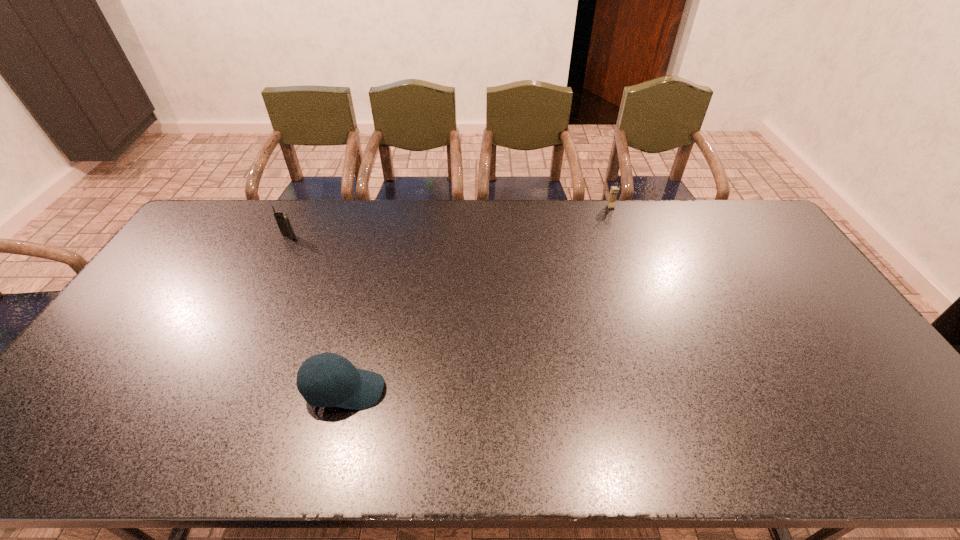
The height and width of the screenshot is (540, 960). In order to click on the right cellular telephone in this screenshot , I will do `click(614, 190)`.

Locate an element on the screen. The width and height of the screenshot is (960, 540). the farther cellular telephone is located at coordinates (614, 190).

Locate an element on the screen. This screenshot has height=540, width=960. the nearer cellular telephone is located at coordinates (282, 219).

Find the location of a particular element. Image resolution: width=960 pixels, height=540 pixels. the leftmost object is located at coordinates (282, 219).

This screenshot has width=960, height=540. Identify the location of the second object from left to right. (357, 389).

Where is `the nearest object`? the nearest object is located at coordinates (357, 389).

You are a GUI agent. You are given a task and a screenshot of the screen. Output one action in this format:
    pyautogui.click(x=<x>, y=<y>)
    Task: Click on the blank space located 0.270m on the front of the rightmost object, where the keypad is located
    Image resolution: width=960 pixels, height=540 pixels.
    Given the screenshot: What is the action you would take?
    pyautogui.click(x=629, y=256)

This screenshot has height=540, width=960. In order to click on vacant space located 0.370m on the keyboard of the leftmost object in this screenshot , I will do `click(247, 322)`.

You are a GUI agent. You are given a task and a screenshot of the screen. Output one action in this format:
    pyautogui.click(x=<x>, y=<y>)
    Task: Click on the free space located on the front-facing side of the baseball cap
    The image size is (960, 540).
    Given the screenshot: What is the action you would take?
    pyautogui.click(x=543, y=390)

Where is `free space at the far edge`? This screenshot has width=960, height=540. free space at the far edge is located at coordinates (414, 204).